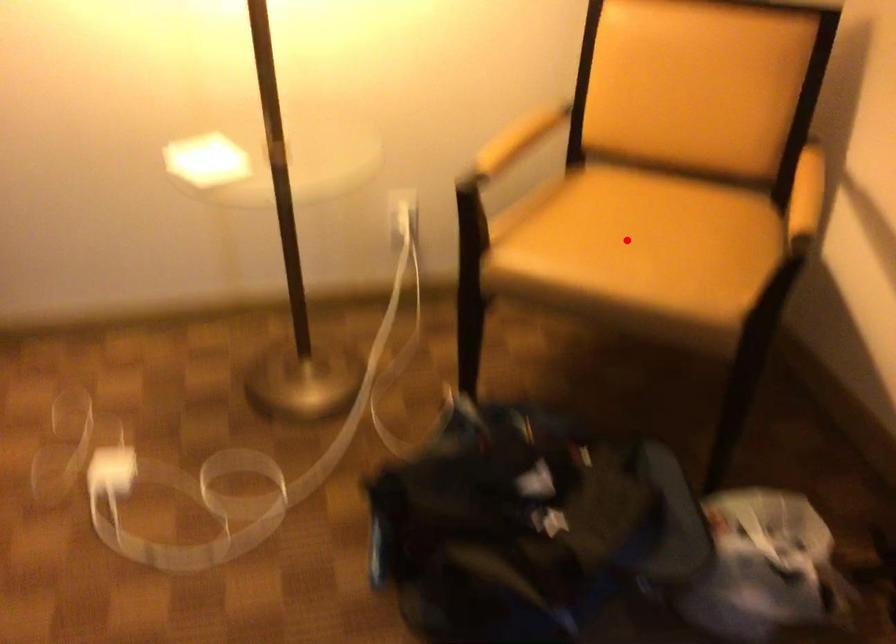
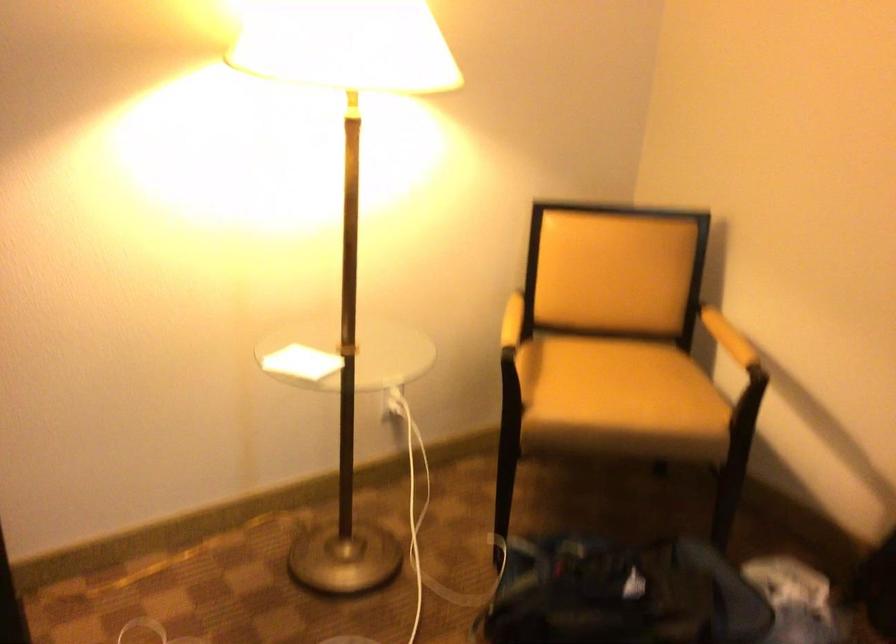
Locate, in the second image, the point that corresponds to the highlighted location in the first image.

(618, 388)